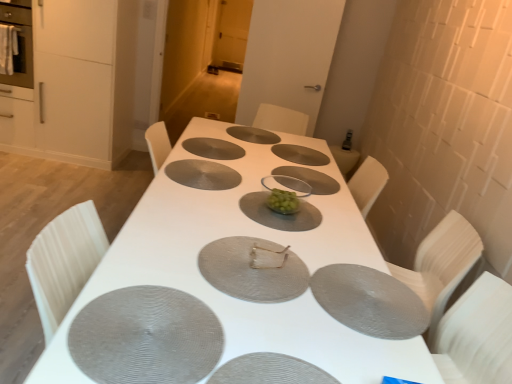
Where is `vacant space behind metallic silver napkin at center`? vacant space behind metallic silver napkin at center is located at coordinates (262, 225).